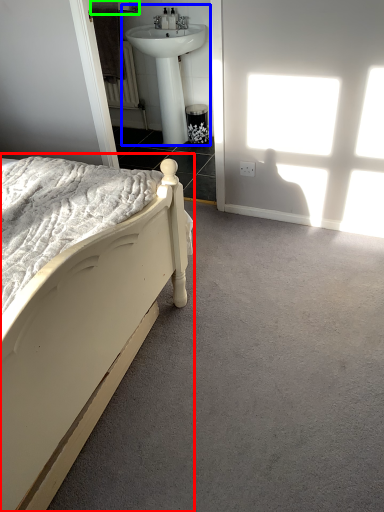
Question: Which is nearer to the bed (highlighted by a red box)? sink (highlighted by a blue box) or towel bar (highlighted by a green box).

Choices:
 (A) sink
 (B) towel bar

Answer: (A)